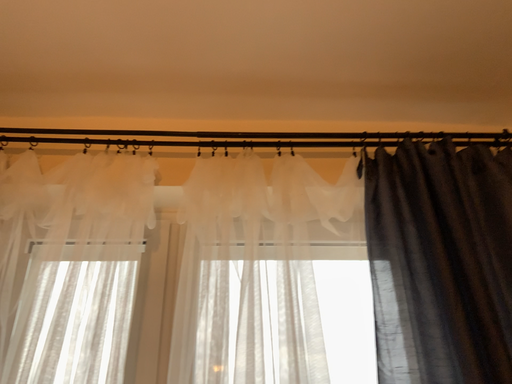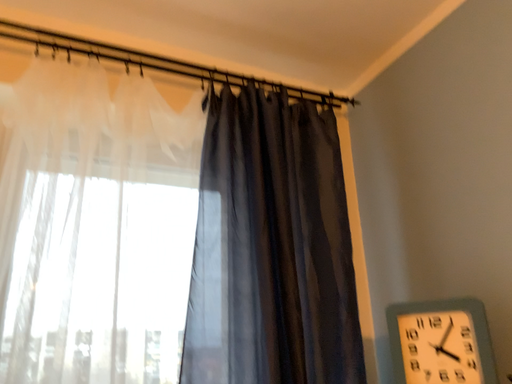
Question: How did the camera likely rotate when shooting the video?

Choices:
 (A) rotated downward
 (B) rotated upward

Answer: (A)